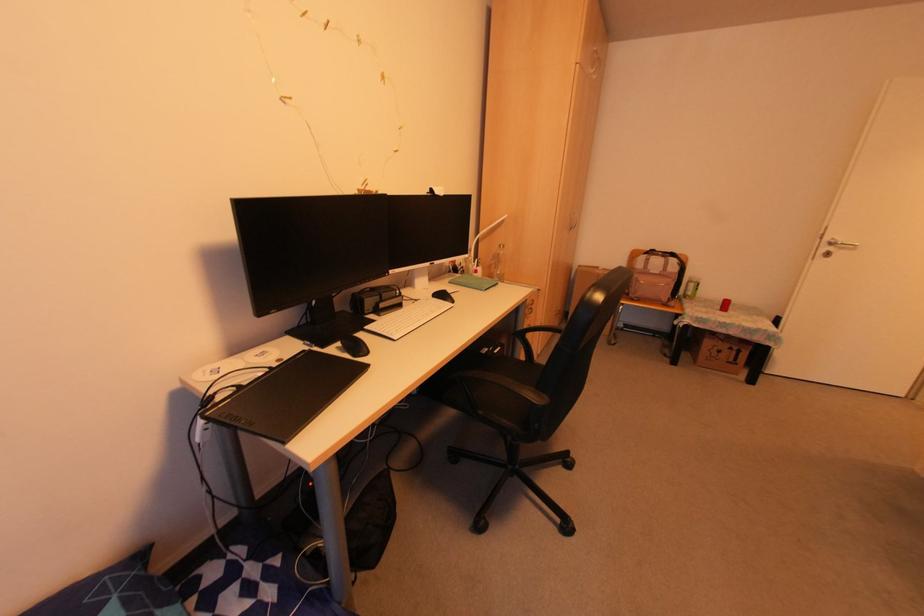
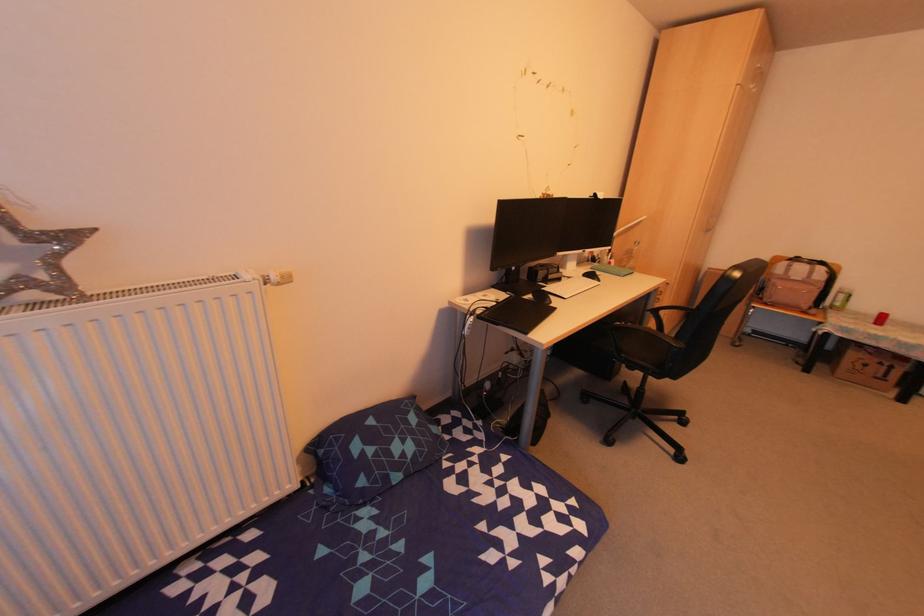
Question: The camera is either moving clockwise (left) or counter-clockwise (right) around the object. The first image is from the beginning of the video and the second image is from the end. Is the camera moving left or right when shooting the video?

Choices:
 (A) Left
 (B) Right

Answer: (B)